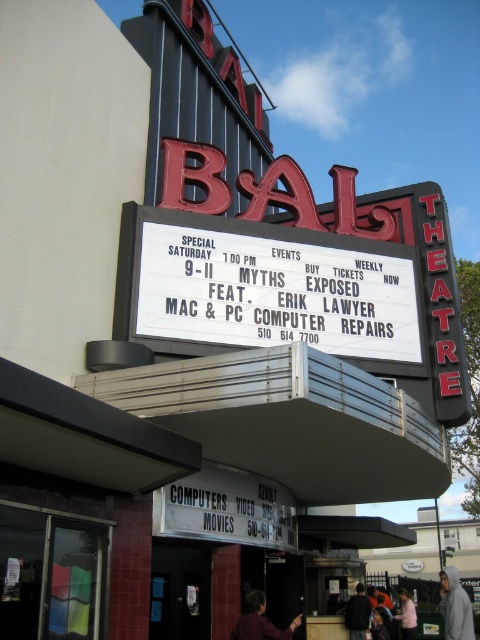
Question: Does white hoodie at lower right appear on the left side of dark brown leather jacket at lower center?

Choices:
 (A) no
 (B) yes

Answer: (A)

Question: Which point appears farthest from the camera in this image?

Choices:
 (A) (450, 600)
 (B) (412, 637)
 (C) (356, 621)
 (D) (345, 317)

Answer: (B)

Question: Among these points, which one is farthest from the camera?

Choices:
 (A) (386, 339)
 (B) (372, 609)
 (C) (411, 634)

Answer: (C)

Question: Does white hoodie at lower right lie behind dark gray sweater at lower right?

Choices:
 (A) yes
 (B) no

Answer: (B)

Question: From the image, what is the correct spatial relationship of white matte sign at center in relation to pink fabric shirt at lower right?

Choices:
 (A) right
 (B) left

Answer: (B)

Question: Which object appears farthest from the camera in this image?

Choices:
 (A) brown leather jacket at lower center
 (B) dark brown leather jacket at lower center
 (C) dark gray sweater at lower right
 (D) pink fabric shirt at lower right

Answer: (D)